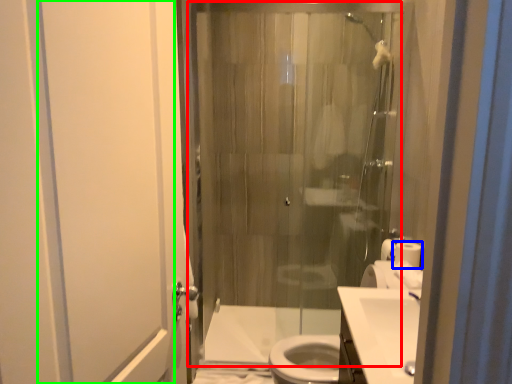
Question: Considering the real-world distances, which object is closest to shower door (highlighted by a red box)? toilet paper (highlighted by a blue box) or screen door (highlighted by a green box).

Choices:
 (A) toilet paper
 (B) screen door

Answer: (A)